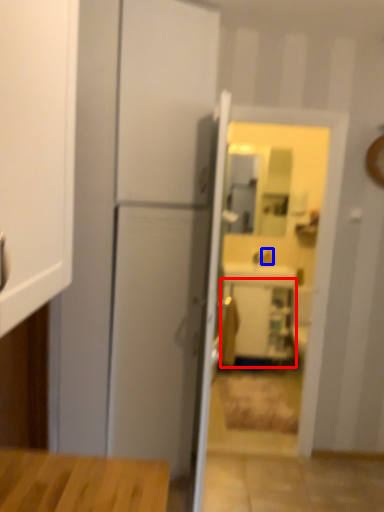
Question: Which of the following is the farthest to the observer, cabinetry (highlighted by a red box) or faucet (highlighted by a blue box)?

Choices:
 (A) cabinetry
 (B) faucet

Answer: (B)